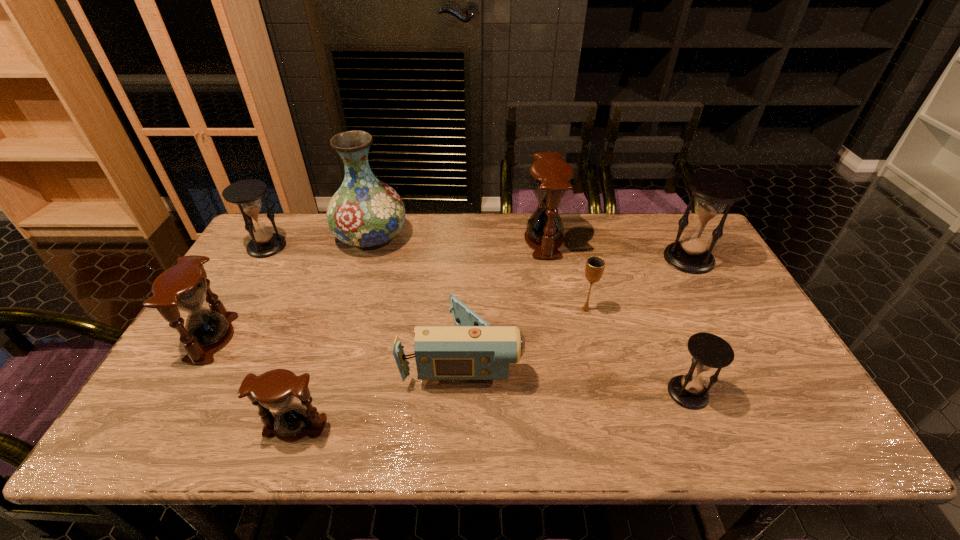
Locate an element on the screen. This screenshot has height=540, width=960. the tallest object is located at coordinates (365, 212).

The width and height of the screenshot is (960, 540). What are the coordinates of `blue vase` in the screenshot? It's located at (365, 212).

The image size is (960, 540). What are the coordinates of `the farthest brown hourglass` in the screenshot? It's located at (550, 179).

The height and width of the screenshot is (540, 960). What are the coordinates of `the rightmost brown hourglass` in the screenshot? It's located at pyautogui.click(x=550, y=179).

Find the location of `the rightmost object`. the rightmost object is located at coordinates (714, 190).

Where is `the biggest black hourglass`? This screenshot has width=960, height=540. the biggest black hourglass is located at coordinates [x=714, y=190].

Locate an element on the screen. the leftmost black hourglass is located at coordinates (264, 243).

You are a GUI agent. You are given a task and a screenshot of the screen. Output one action in this format:
    pyautogui.click(x=<x>, y=<y>)
    Task: Click on the third nearest hourglass
    
    Given the screenshot: What is the action you would take?
    pyautogui.click(x=183, y=287)

At what (x,y) coordinates should I click in order to perform the action: click on the leftmost brown hourglass. Please return your answer as a coordinate pair (x, y). Looking at the image, I should click on (183, 287).

This screenshot has width=960, height=540. Find the location of `chalice`. chalice is located at coordinates (595, 265).